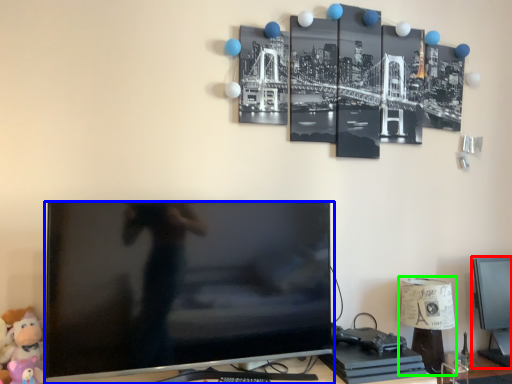
Question: Considering the real-world distances, which object is farthest from computer monitor (highlighted by a red box)? television (highlighted by a blue box) or table lamp (highlighted by a green box)?

Choices:
 (A) television
 (B) table lamp

Answer: (A)